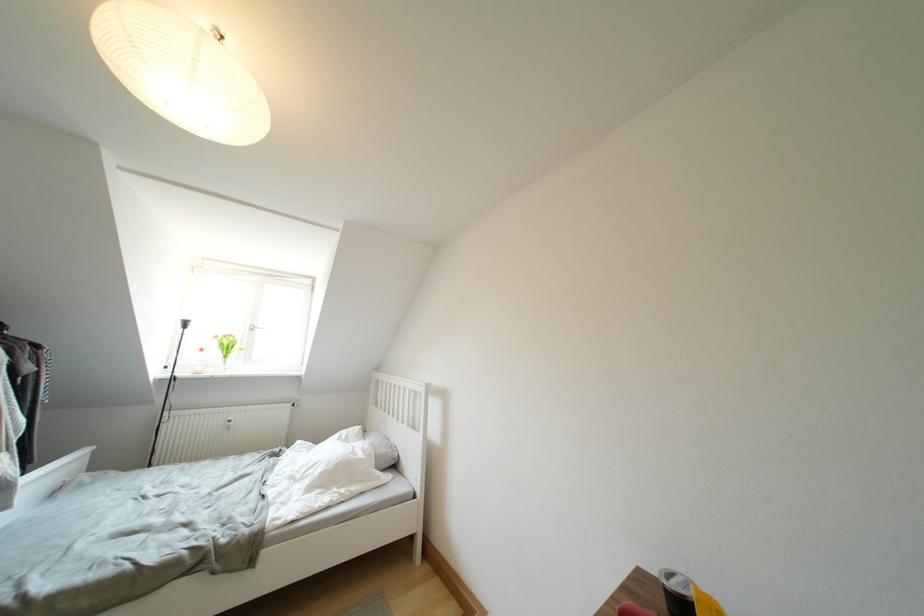
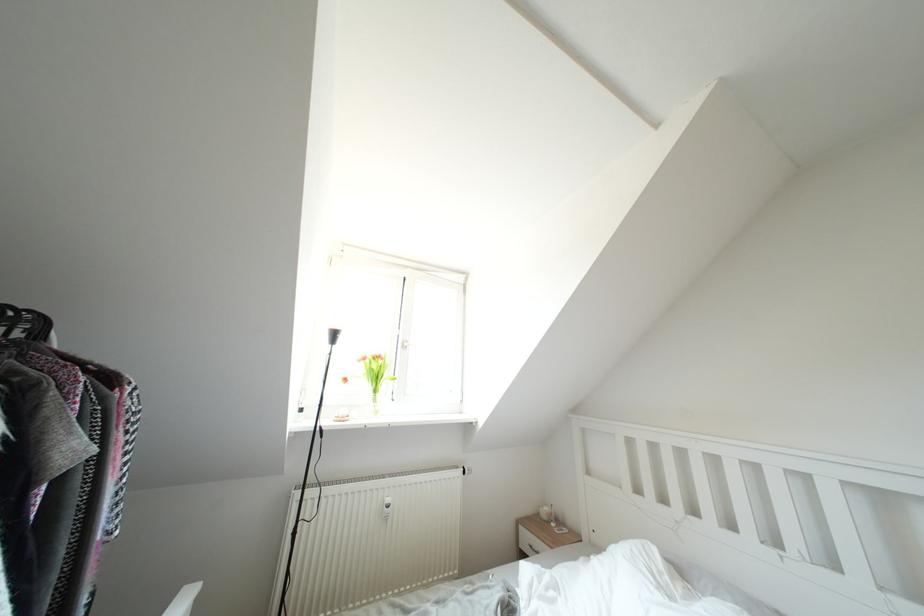
The point at (222,341) is marked in the first image. Where is the corresponding point in the second image?

(370, 363)